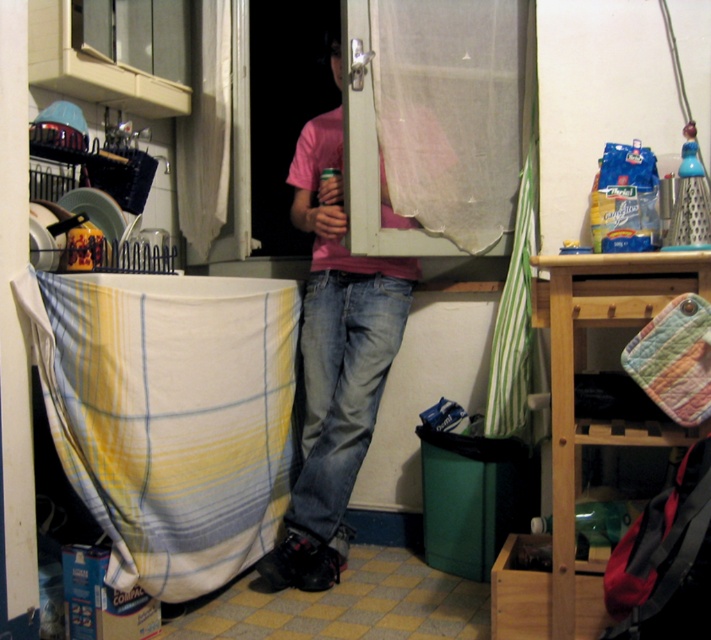
Question: Which of these objects is positioned farthest from the pink cotton shirt at center?

Choices:
 (A) matte plastic screen door at center
 (B) yellow/white plaid fabric at lower left

Answer: (A)

Question: Which of the following is the closest to the observer?

Choices:
 (A) (229, 384)
 (B) (360, 385)

Answer: (A)

Question: Does yellow/white plaid fabric at lower left have a larger size compared to matte plastic screen door at center?

Choices:
 (A) yes
 (B) no

Answer: (B)

Question: Is yellow/white plaid fabric at lower left thinner than matte plastic screen door at center?

Choices:
 (A) no
 (B) yes

Answer: (A)

Question: Does pink cotton shirt at center have a lesser width compared to matte plastic screen door at center?

Choices:
 (A) no
 (B) yes

Answer: (B)

Question: Which point is closer to the camera?

Choices:
 (A) (319, 324)
 (B) (269, 8)
 (C) (240, 358)

Answer: (C)